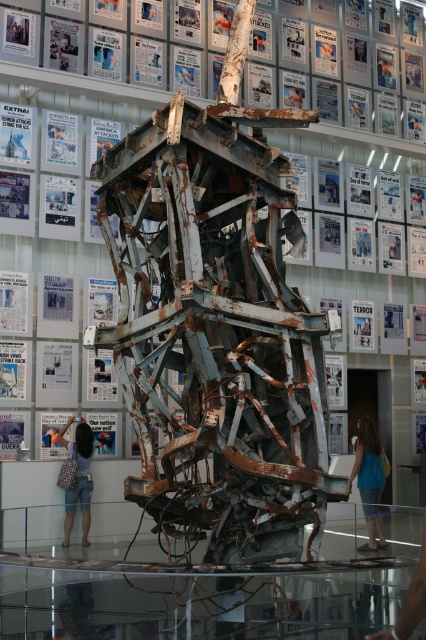
You are an exhibit designer who needs to place a new label next to both the blue denim jeans at lower right and the white paper at upper left. Which object requires more horizontal space for its label?

The blue denim jeans at lower right might require more horizontal space for its label since it might be wider than the white paper at upper left.

You are a visitor at the exhibition and want to take a photo of the entire metal structure. You notice two points marked on the structure at coordinates point (397, 154) and point (26, 48). Which point should you focus on to ensure both points are visible in your photo?

You should focus on point (26, 48) because point (397, 154) is behind it, so focusing on the closer point will keep both in focus.

You are standing in a museum and see the rusty metal sculpture at center. Where exactly is it located in the room?

The rusty metal sculpture at center is located at point [350,145] in the room.